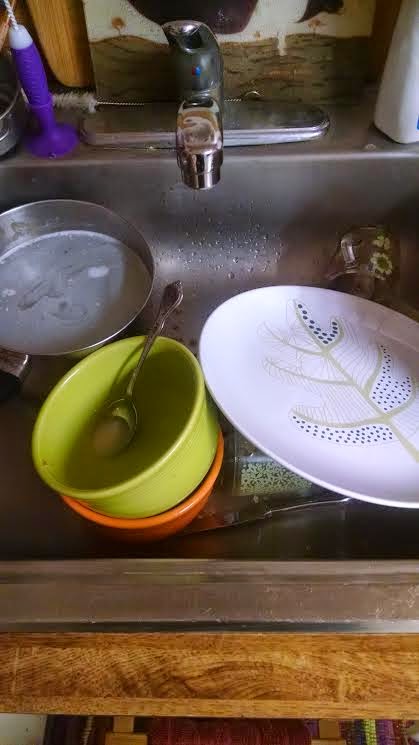
You are a GUI agent. You are given a task and a screenshot of the screen. Output one action in this format:
    pyautogui.click(x=<x>, y=<y>)
    Task: Click on the side of orange bowl
    The image size is (419, 745).
    Given the screenshot: What is the action you would take?
    pyautogui.click(x=180, y=519)